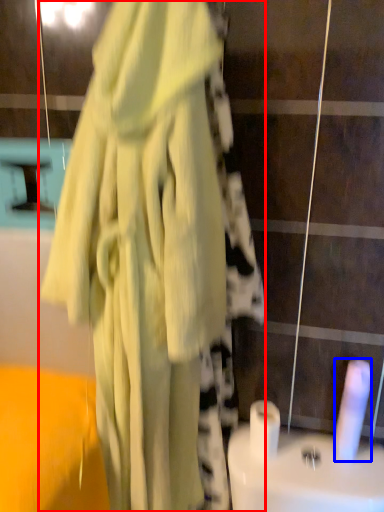
Question: Which of the following is the farthest to the observer, fancy dress (highlighted by a red box) or toilet paper (highlighted by a blue box)?

Choices:
 (A) fancy dress
 (B) toilet paper

Answer: (B)